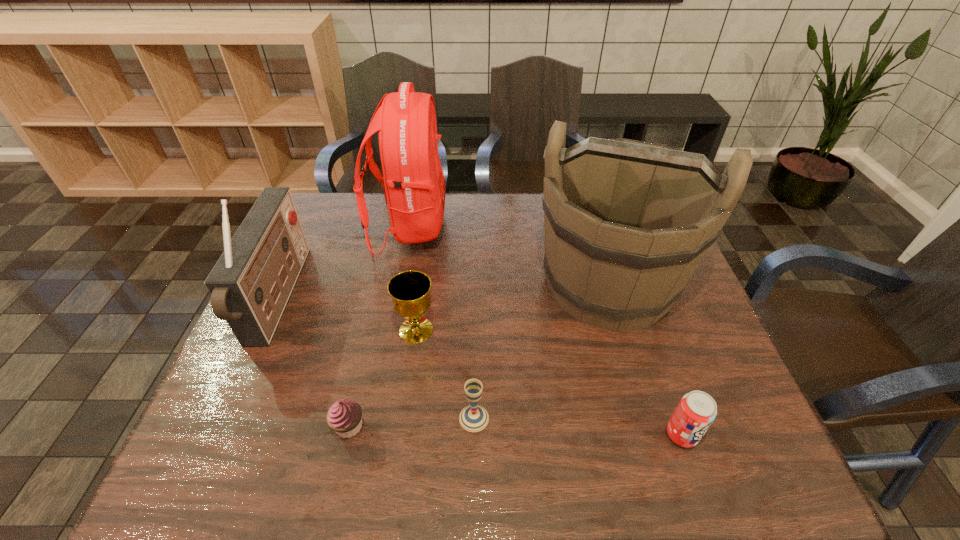
This screenshot has width=960, height=540. I want to click on backpack, so click(x=414, y=182).

The image size is (960, 540). I want to click on bucket, so point(626,223).

This screenshot has width=960, height=540. In order to click on the fifth shortest object in this screenshot , I will do `click(250, 284)`.

This screenshot has height=540, width=960. Identify the location of radio receiver. (250, 284).

At what (x,y) coordinates should I click in order to perform the action: click on the taller chalice. Please return your answer as a coordinate pair (x, y). Looking at the image, I should click on (410, 290).

Find the location of a particular element. This screenshot has width=960, height=540. the farther chalice is located at coordinates (410, 290).

The height and width of the screenshot is (540, 960). I want to click on soda can, so click(697, 410).

Where is `the fifth object from left to right`? This screenshot has height=540, width=960. the fifth object from left to right is located at coordinates (473, 418).

I want to click on the shorter chalice, so click(473, 418).

This screenshot has width=960, height=540. In order to click on the shortest object in this screenshot , I will do coord(344,417).